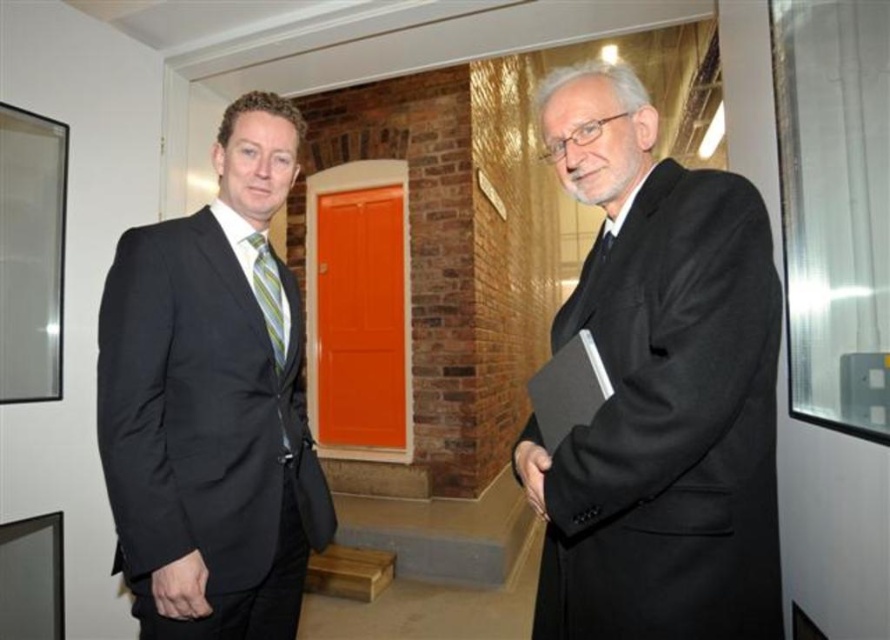
You are a photographer setting up for a portrait. You notice the green striped tie at left and the smooth black hand at right in your frame. Which object is taller in the image?

The green striped tie at left is taller than the smooth black hand at right.

You are a photographer setting up for a group photo. You notice the black suit at left and the green striped tie at left in the scene. Which one is more to the left?

The black suit at left is more to the left because it is positioned on the left side of the green striped tie at left.